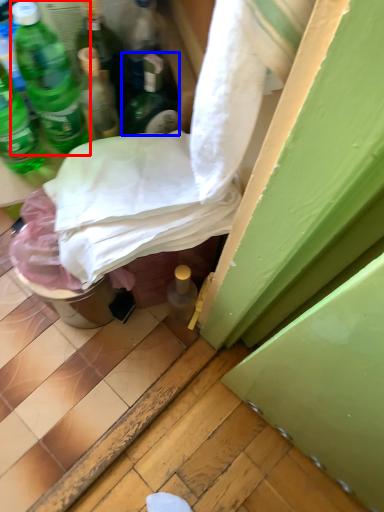
Question: Which object is closer to the camera taking this photo, bottle (highlighted by a red box) or bottle (highlighted by a blue box)?

Choices:
 (A) bottle
 (B) bottle

Answer: (A)